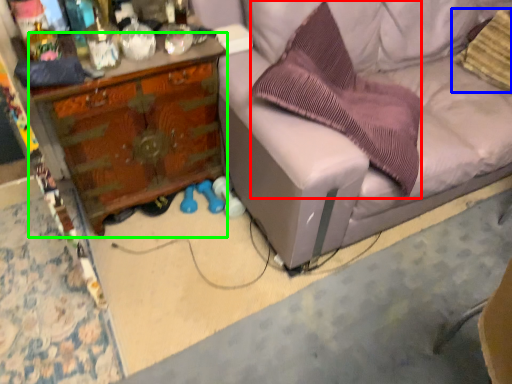
Question: Which object is the closest to the pillow (highlighted by a red box)? Choose among these: pillow (highlighted by a blue box) or desk (highlighted by a green box).

Choices:
 (A) pillow
 (B) desk

Answer: (B)